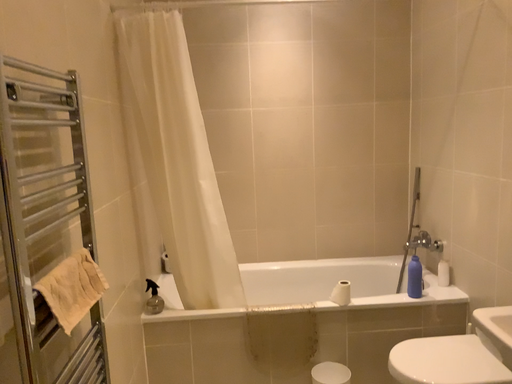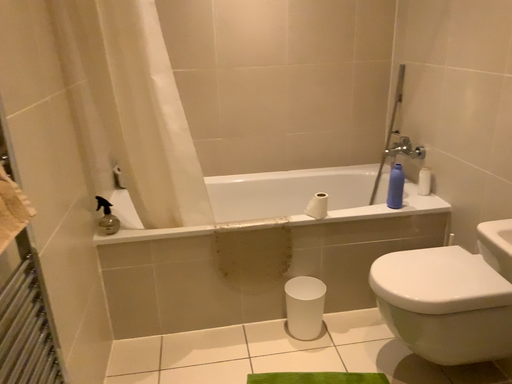
Question: How did the camera likely rotate when shooting the video?

Choices:
 (A) rotated downward
 (B) rotated upward

Answer: (A)